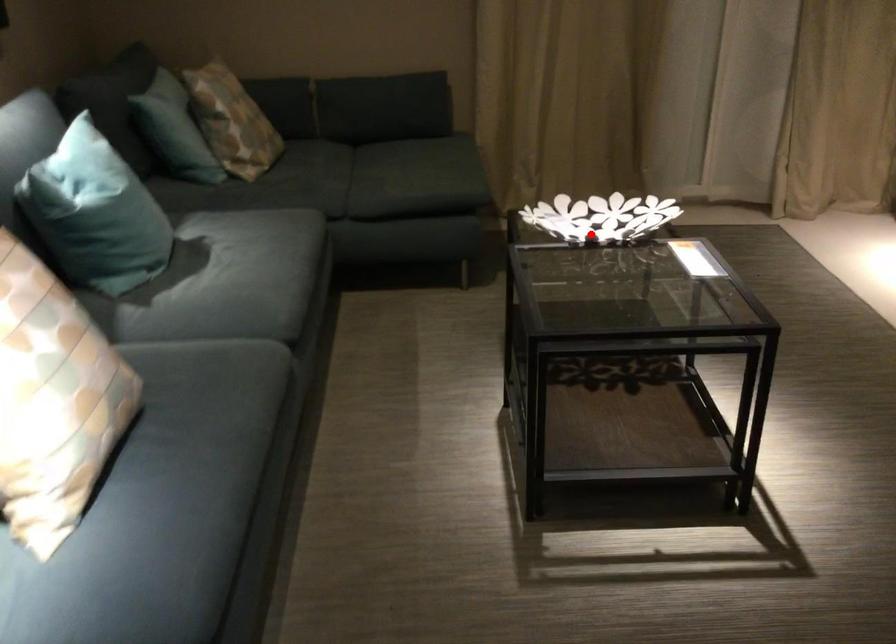
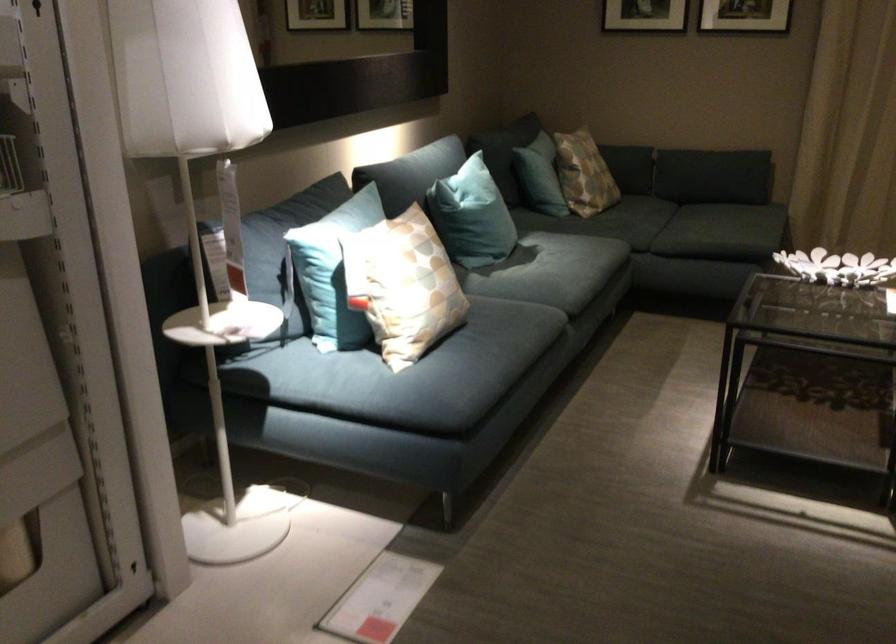
In the second image, find the point that corresponds to the highlighted location in the first image.

(837, 267)